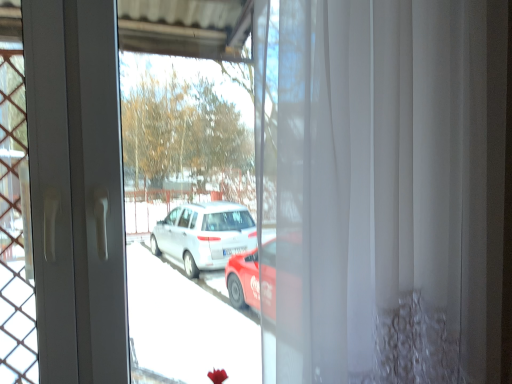
Question: Is transparent plastic curtain at right taller than white sheer curtain at center?

Choices:
 (A) no
 (B) yes

Answer: (B)

Question: Is white sheer curtain at center at the back of transparent plastic curtain at right?

Choices:
 (A) no
 (B) yes

Answer: (A)

Question: Considering the relative positions of transparent plastic curtain at right and white sheer curtain at center in the image provided, is transparent plastic curtain at right to the right of white sheer curtain at center from the viewer's perspective?

Choices:
 (A) yes
 (B) no

Answer: (B)

Question: Is transparent plastic curtain at right bigger than white sheer curtain at center?

Choices:
 (A) no
 (B) yes

Answer: (A)

Question: From the image's perspective, would you say transparent plastic curtain at right is shown under white sheer curtain at center?

Choices:
 (A) no
 (B) yes

Answer: (B)

Question: Does transparent plastic curtain at right appear on the left side of white sheer curtain at center?

Choices:
 (A) yes
 (B) no

Answer: (A)

Question: From the image's perspective, is white sheer curtain at center on top of transparent plastic curtain at right?

Choices:
 (A) no
 (B) yes

Answer: (B)

Question: Is there a large distance between white sheer curtain at center and transparent plastic curtain at right?

Choices:
 (A) no
 (B) yes

Answer: (A)

Question: From a real-world perspective, is white sheer curtain at center below transparent plastic curtain at right?

Choices:
 (A) yes
 (B) no

Answer: (B)

Question: Is white sheer curtain at center thinner than transparent plastic curtain at right?

Choices:
 (A) no
 (B) yes

Answer: (A)

Question: Is white sheer curtain at center beside transparent plastic curtain at right?

Choices:
 (A) yes
 (B) no

Answer: (B)

Question: From the image's perspective, does white sheer curtain at center appear lower than transparent plastic curtain at right?

Choices:
 (A) no
 (B) yes

Answer: (A)

Question: Is white sheer curtain at center inside or outside of transparent plastic curtain at right?

Choices:
 (A) inside
 (B) outside

Answer: (B)